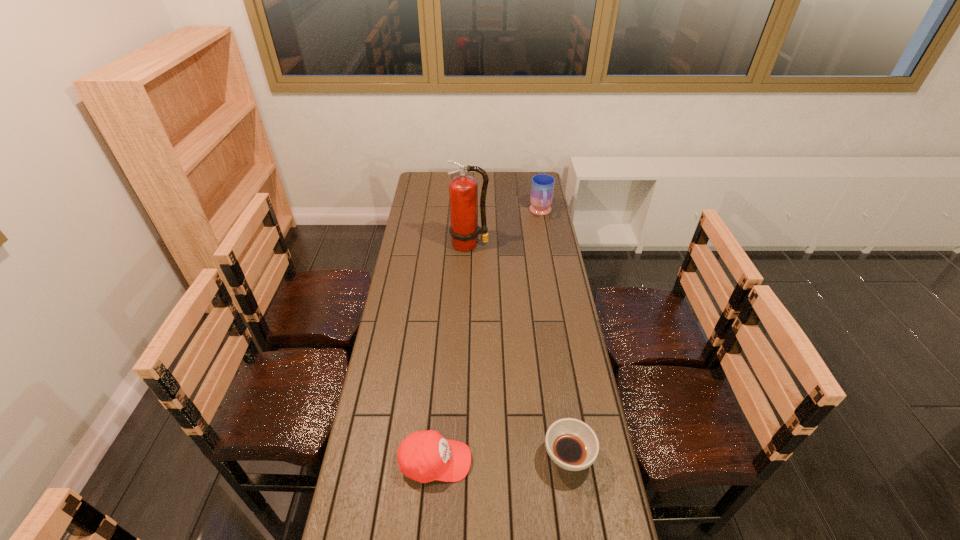
I want to click on the tallest object, so click(x=463, y=190).

Where is `fire extinguisher`? fire extinguisher is located at coordinates (463, 190).

The height and width of the screenshot is (540, 960). Find the location of `the farthest object`. the farthest object is located at coordinates (542, 187).

Locate an element on the screen. The width and height of the screenshot is (960, 540). mug is located at coordinates (542, 187).

Where is `baseball cap`? This screenshot has height=540, width=960. baseball cap is located at coordinates (424, 456).

The height and width of the screenshot is (540, 960). In order to click on the shortest object in this screenshot , I will do click(x=573, y=445).

You are a GUI agent. You are given a task and a screenshot of the screen. Output one action in this format:
    pyautogui.click(x=<x>, y=<y>)
    Task: Click on the vacant area located at the nozzle of the tallest object
    The width and height of the screenshot is (960, 540).
    Given the screenshot: What is the action you would take?
    pyautogui.click(x=468, y=275)

In order to click on vacant space located on the side of the second tallest object with the handle in this screenshot , I will do `click(546, 244)`.

Find the location of a particular element. free region located 0.230m on the front panel of the baseball cap is located at coordinates (549, 462).

You are a GUI agent. You are given a task and a screenshot of the screen. Output one action in this format:
    pyautogui.click(x=<x>, y=<y>)
    Task: Click on the free spot located on the back of the soup bowl
    The height and width of the screenshot is (540, 960).
    Given the screenshot: What is the action you would take?
    pyautogui.click(x=550, y=335)